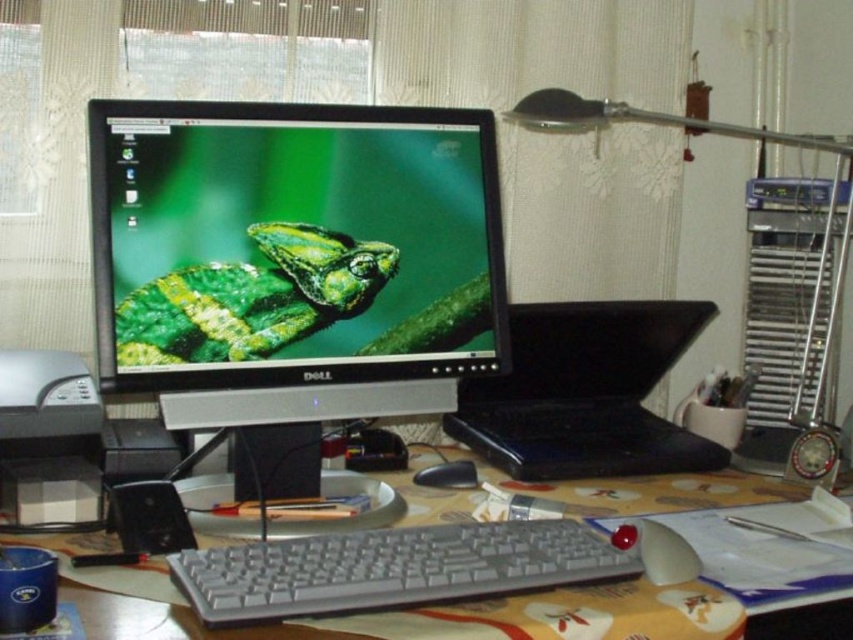
Question: From the image, what is the correct spatial relationship of black plastic laptop at center in relation to gray plastic keyboard at center?

Choices:
 (A) left
 (B) right

Answer: (B)

Question: Is matte plastic computer desk at center to the left of black rubber mouse at center from the viewer's perspective?

Choices:
 (A) no
 (B) yes

Answer: (A)

Question: Which object is positioned farthest from the black plastic laptop at center?

Choices:
 (A) black rubber mouse at center
 (B) green matte chameleon at center

Answer: (B)

Question: Which of the following is the farthest from the observer?

Choices:
 (A) (347, 547)
 (B) (155, 330)

Answer: (B)

Question: Which object is farther from the camera taking this photo?

Choices:
 (A) black plastic laptop at center
 (B) black rubber mouse at center
 (C) white matte mouse at lower right

Answer: (A)

Question: Does matte black monitor at center appear on the right side of matte plastic computer desk at center?

Choices:
 (A) no
 (B) yes

Answer: (A)